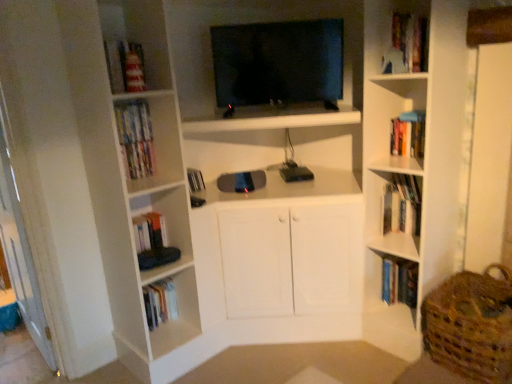
Question: From a real-world perspective, relative to matte plastic bookshelf at upper left, positioned as the first book in top-to-bottom order, is black glossy tv at upper center vertically above or below?

Choices:
 (A) above
 (B) below

Answer: (A)

Question: Is black glossy tv at upper center to the left or to the right of matte plastic bookshelf at upper left, which appears as the fifth book when ordered from the bottom, in the image?

Choices:
 (A) right
 (B) left

Answer: (A)

Question: Which object is the farthest from the black glossy tv at upper center?

Choices:
 (A) matte plastic bookshelf at upper left, positioned as the first book in top-to-bottom order
 (B) wooden bookshelf at upper right
 (C) hardcover books at upper right, the 2th book when ordered from top to bottom
 (D) hardcover book at upper right, which appears as the fourth book when viewed from the left
 (E) woven brown basket at lower right

Answer: (E)

Question: Which is farther from the hardcover book at upper right, which appears as the fourth book when viewed from the left?

Choices:
 (A) matte plastic bookshelf at upper left, which appears as the fifth book when ordered from the bottom
 (B) hardcover books at right, the third book positioned from the left
 (C) hardcover books at upper right, which is counted as the 5th book, starting from the left
 (D) white matte book at upper right, arranged as the fourth book when viewed from the right
 (E) black glossy tv at upper center

Answer: (A)